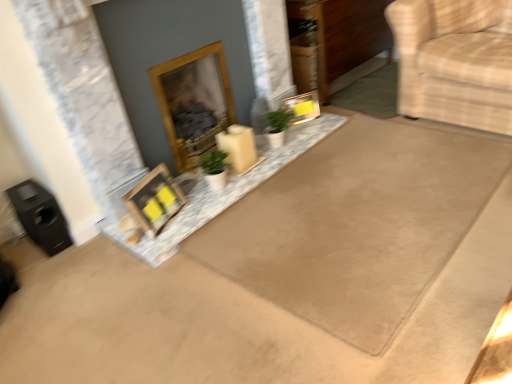
The image size is (512, 384). Find the location of `free space to the right of white marble tray at center`. free space to the right of white marble tray at center is located at coordinates (379, 165).